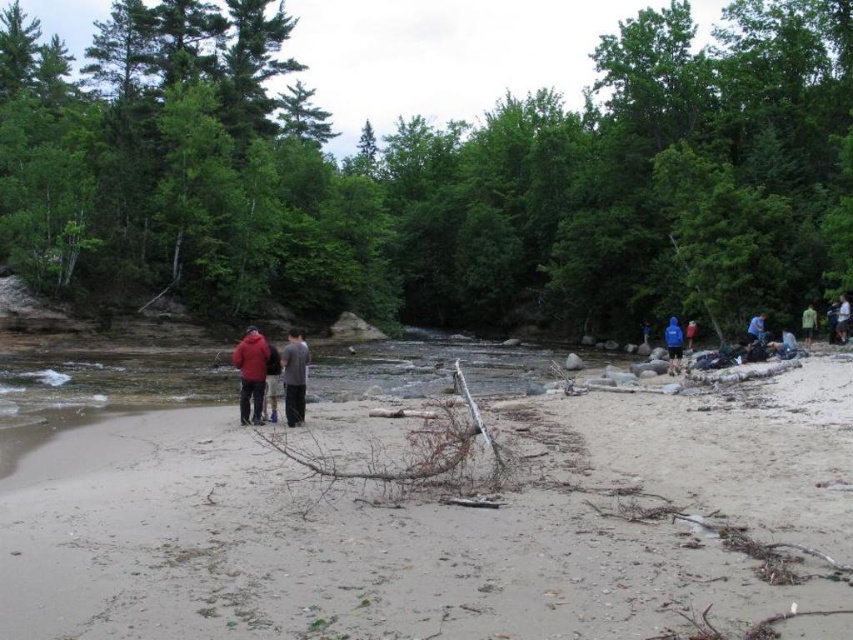
Question: Which is farther from the green fabric shirt at right?

Choices:
 (A) blue fabric jacket at center-right
 (B) dark gray cotton shirt at center

Answer: (B)

Question: In this image, where is green fabric shirt at right located relative to blue fabric jacket at center-right?

Choices:
 (A) below
 (B) above

Answer: (B)

Question: Which object is positioned closest to the sandy beach at center?

Choices:
 (A) blue fabric jacket at center-right
 (B) white cotton shirt at right
 (C) matte red jacket at center

Answer: (C)

Question: Is blue fabric jacket at right further to the viewer compared to blue fabric shirt at right?

Choices:
 (A) no
 (B) yes

Answer: (A)

Question: Does blue fabric jacket at right have a lesser width compared to blue fabric shirt at right?

Choices:
 (A) no
 (B) yes

Answer: (A)

Question: Which object appears farthest from the camera in this image?

Choices:
 (A) matte gray hoodie at center
 (B) blue fabric jacket at center-right
 (C) blue fabric jacket at right

Answer: (B)